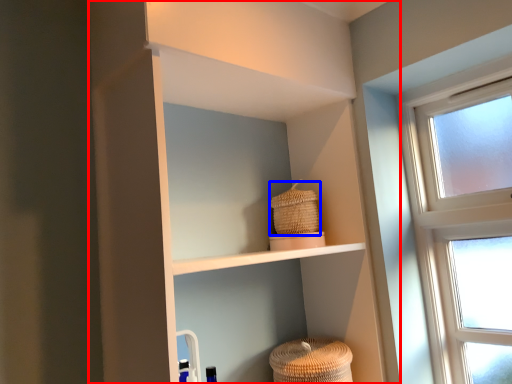
Question: Which point is closer to the camera, shelf (highlighted by a red box) or basket (highlighted by a blue box)?

Choices:
 (A) shelf
 (B) basket

Answer: (A)